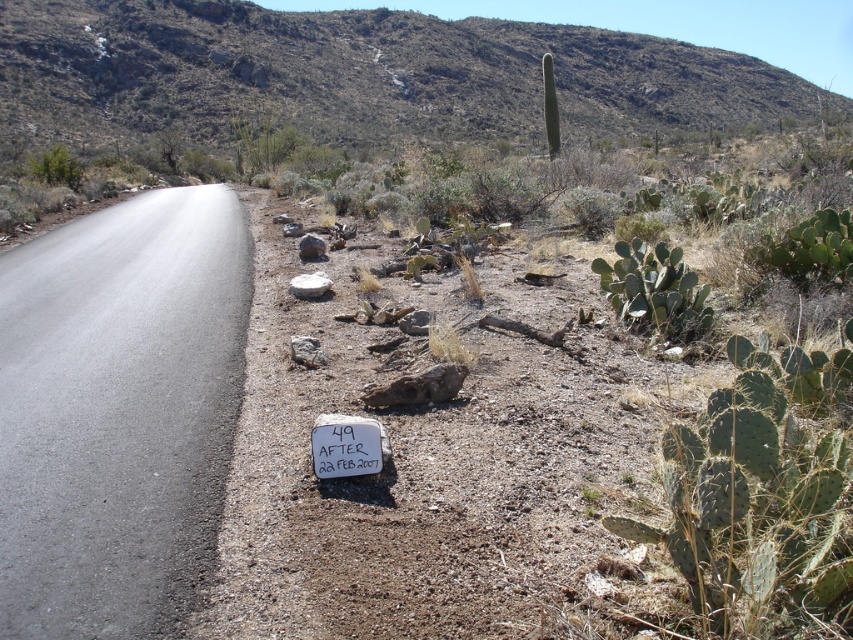
You are a hiker navigating a desert road. You see two points marked on your map at coordinates point (x=552, y=132) and point (x=286, y=225). Which point is farther away from your current position?

Point (x=552, y=132) is behind point (x=286, y=225), so it is farther away from your current position.

You are standing at the edge of the desert road and see two points marked in the scene. Which point, point (369, 458) or point (310, 237), is closer to your current position?

Point (369, 458) is closer to the viewer than point (310, 237).